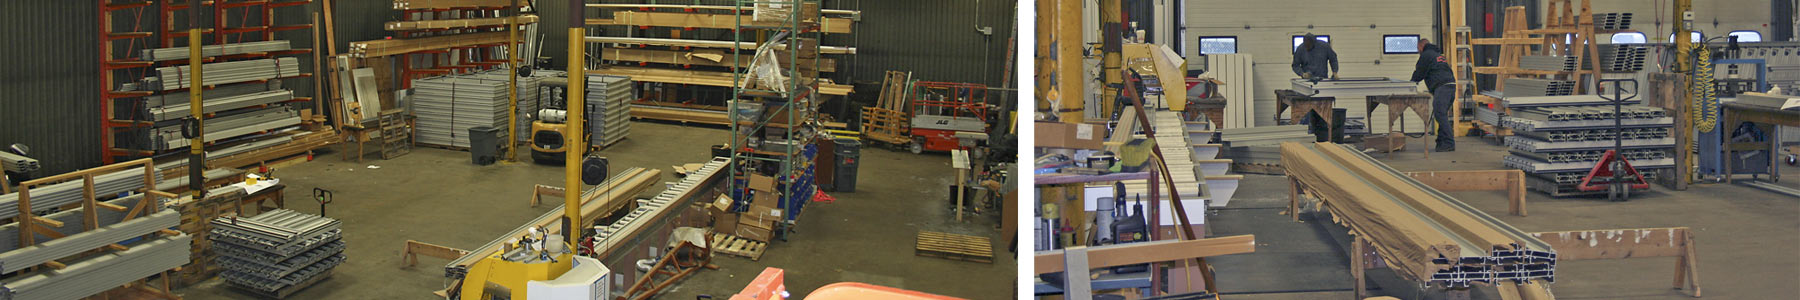
Image resolution: width=1800 pixels, height=300 pixels. Identify the location of floor. (428, 187), (893, 232), (1627, 205).